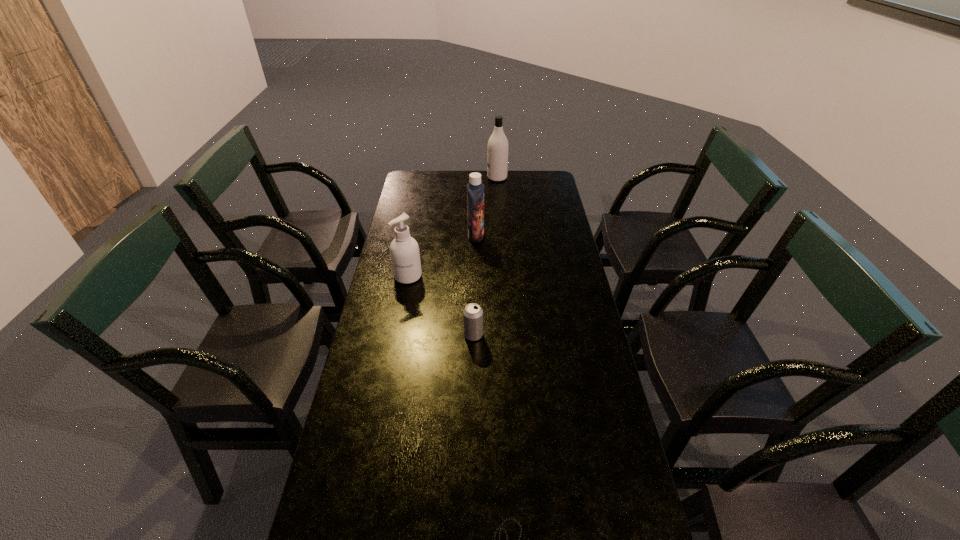
Find the location of a particular element. free space that satisfies the following two spatial constraints: 1. on the front-facing side of the farther shampoo; 2. on the front label of the third farthest object is located at coordinates 503,276.

Image resolution: width=960 pixels, height=540 pixels. What are the coordinates of `vacant region that satisfies the following two spatial constraints: 1. on the front label of the cleansing agent; 2. on the right side of the fourth tallest object` in the screenshot? It's located at (396, 335).

At what (x,y) coordinates should I click in order to perform the action: click on free point that satisfies the following two spatial constraints: 1. on the front label of the second shortest object; 2. on the left side of the third nearest object. Please return your answer as a coordinate pair (x, y). This screenshot has height=540, width=960. Looking at the image, I should click on (396, 335).

The height and width of the screenshot is (540, 960). I want to click on free location that satisfies the following two spatial constraints: 1. on the front label of the fourth nearest object; 2. on the front side of the second nearest object, so click(474, 335).